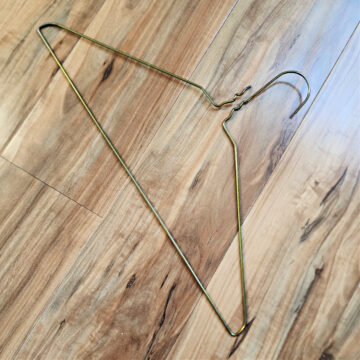
Locate an element on the screen. The width and height of the screenshot is (360, 360). left side of hanger is located at coordinates (44, 26).